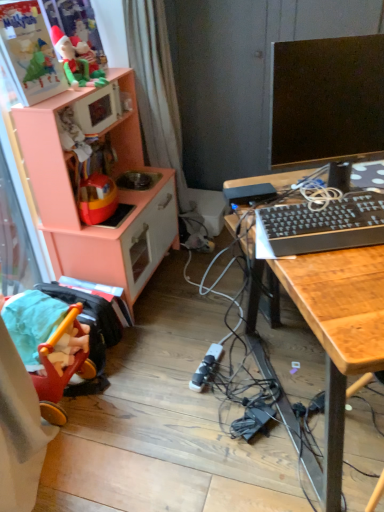
The height and width of the screenshot is (512, 384). Find the location of `free space in front of black plastic plug at center`. free space in front of black plastic plug at center is located at coordinates (203, 405).